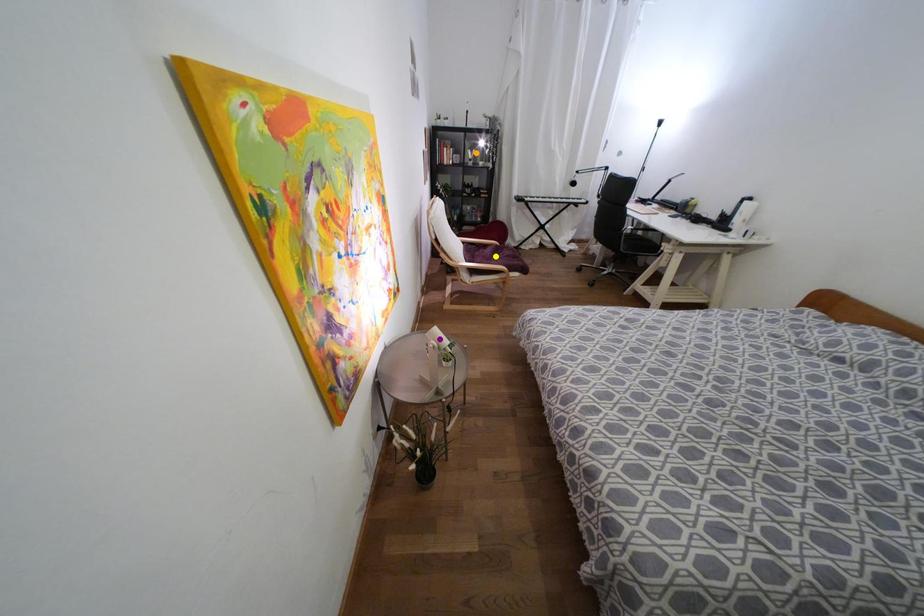
Order these from nearest to farthest:
- purple point
- orange point
- yellow point

orange point → yellow point → purple point